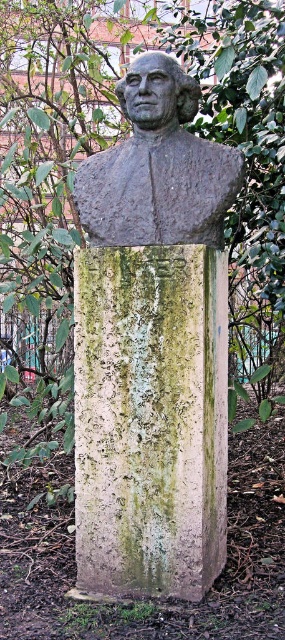
Question: Is green mossy stone pillar at center bigger than gray stone bust at center?

Choices:
 (A) no
 (B) yes

Answer: (B)

Question: Is green mossy stone pillar at center wider than gray stone bust at center?

Choices:
 (A) no
 (B) yes

Answer: (A)

Question: In this image, where is green mossy stone pillar at center located relative to gray stone bust at center?

Choices:
 (A) left
 (B) right

Answer: (A)